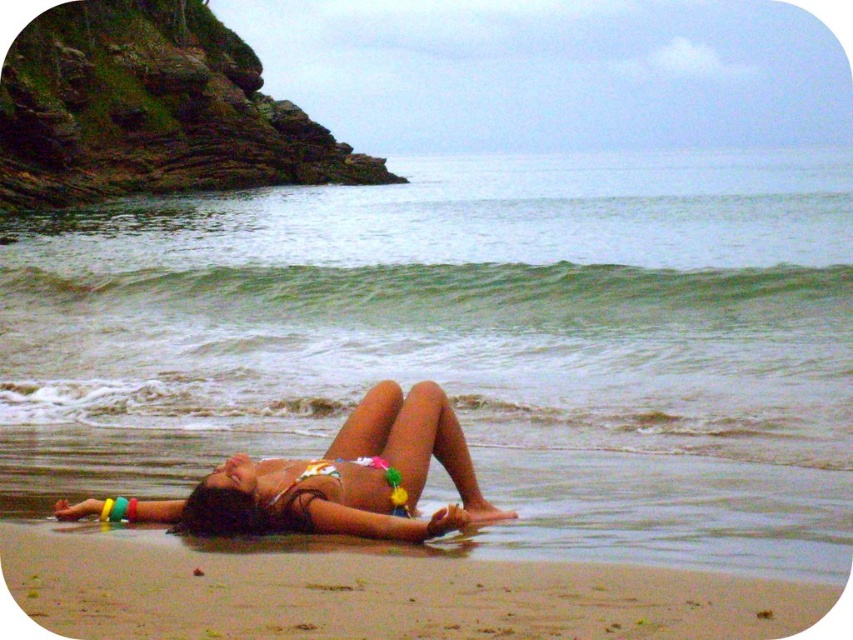
Question: Can you confirm if smooth tan sand at lower center is positioned above white bikini at center?

Choices:
 (A) no
 (B) yes

Answer: (A)

Question: Among these points, which one is nearest to the camera?

Choices:
 (A) (322, 572)
 (B) (308, 477)

Answer: (A)

Question: Which point is closer to the camera taking this photo?

Choices:
 (A) (122, 625)
 (B) (381, 420)

Answer: (A)

Question: Can you confirm if smooth tan sand at lower center is smaller than white bikini at center?

Choices:
 (A) no
 (B) yes

Answer: (B)

Question: Which object is closer to the camera taking this photo?

Choices:
 (A) white bikini at center
 (B) smooth tan sand at lower center

Answer: (B)

Question: Is smooth tan sand at lower center to the left of white bikini at center from the viewer's perspective?

Choices:
 (A) yes
 (B) no

Answer: (B)